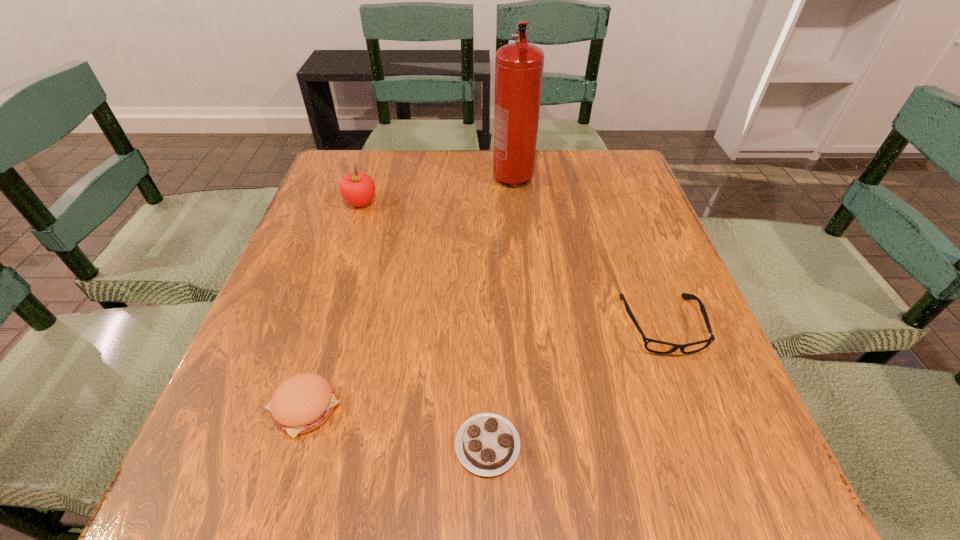
Locate an element on the screen. The width and height of the screenshot is (960, 540). vacant region at the right edge of the desktop is located at coordinates (646, 227).

In the image, there is a desktop. Identify the location of vacant space at the far left corner. (x=369, y=166).

The width and height of the screenshot is (960, 540). What are the coordinates of `vacant position at the near left corner of the desktop` in the screenshot? It's located at (280, 498).

Find the location of a particular element. This screenshot has height=540, width=960. vacant space at the far right corner of the desktop is located at coordinates (583, 154).

You are a GUI agent. You are given a task and a screenshot of the screen. Output one action in this format:
    pyautogui.click(x=<x>, y=<y>)
    Task: Click on the vacant space that's between the tallest object and the rightmost object
    This screenshot has height=540, width=960.
    Given the screenshot: What is the action you would take?
    pyautogui.click(x=588, y=252)

Locate an element on the screen. The image size is (960, 540). vacant point located between the patty and the chocolate cake is located at coordinates (396, 427).

The image size is (960, 540). I want to click on free space between the shortest object and the fourth shortest object, so click(x=424, y=325).

Identify the location of free space that is in between the spectacles and the shortest object. This screenshot has height=540, width=960. (575, 386).

The height and width of the screenshot is (540, 960). In order to click on vacant space that is in between the tallest object and the patty in this screenshot , I will do `click(409, 293)`.

You are a GUI agent. You are given a task and a screenshot of the screen. Output one action in this format:
    pyautogui.click(x=<x>, y=<y>)
    Task: Click on the empty space that is in between the shortest object and the patty
    
    Given the screenshot: What is the action you would take?
    pyautogui.click(x=396, y=427)